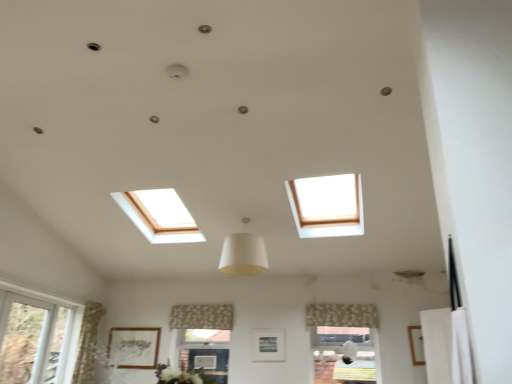
Question: Is white fabric lampshade at center oriented away from matte silver picture frame at center, the 2th picture frame when ordered from right to left?

Choices:
 (A) yes
 (B) no

Answer: (B)

Question: Does white fabric lampshade at center appear on the right side of matte silver picture frame at center, which is the 2th picture frame in front-to-back order?

Choices:
 (A) yes
 (B) no

Answer: (B)

Question: Considering the relative sizes of white fabric lampshade at center and matte silver picture frame at center, positioned as the 2th picture frame in back-to-front order, in the image provided, is white fabric lampshade at center smaller than matte silver picture frame at center, positioned as the 2th picture frame in back-to-front order,?

Choices:
 (A) no
 (B) yes

Answer: (A)

Question: Is white fabric lampshade at center shorter than matte silver picture frame at center, arranged as the second picture frame when viewed from the left?

Choices:
 (A) no
 (B) yes

Answer: (A)

Question: Could you tell me if white fabric lampshade at center is facing matte silver picture frame at center, which is the 2th picture frame in front-to-back order?

Choices:
 (A) yes
 (B) no

Answer: (B)

Question: Is the position of white fabric lampshade at center less distant than that of matte silver picture frame at center, arranged as the second picture frame when viewed from the left?

Choices:
 (A) no
 (B) yes

Answer: (B)

Question: From a real-world perspective, is patterned fabric curtain at lower center, which appears as the 1th curtain when viewed from the right, physically above matte silver picture frame at center, positioned as the 2th picture frame in back-to-front order?

Choices:
 (A) no
 (B) yes

Answer: (B)

Question: Is patterned fabric curtain at lower center, the first curtain when ordered from front to back, to the right of matte silver picture frame at center, which is the 2th picture frame in front-to-back order, from the viewer's perspective?

Choices:
 (A) no
 (B) yes

Answer: (B)

Question: Is patterned fabric curtain at lower center, which appears as the 1th curtain when viewed from the right, taller than matte silver picture frame at center, positioned as the 2th picture frame in back-to-front order?

Choices:
 (A) yes
 (B) no

Answer: (B)

Question: Can you confirm if patterned fabric curtain at lower center, arranged as the second curtain when viewed from the back, is smaller than matte silver picture frame at center, which is the 2th picture frame in front-to-back order?

Choices:
 (A) yes
 (B) no

Answer: (B)

Question: Would you consider patterned fabric curtain at lower center, which appears as the 1th curtain when viewed from the right, to be distant from matte silver picture frame at center, the 2th picture frame when ordered from right to left?

Choices:
 (A) no
 (B) yes

Answer: (A)

Question: Is matte silver picture frame at center, which is the 2th picture frame in front-to-back order, inside patterned fabric curtain at lower center, positioned as the 2th curtain in left-to-right order?

Choices:
 (A) yes
 (B) no

Answer: (B)

Question: Is the position of matte silver picture frame at center, positioned as the 2th picture frame in back-to-front order, less distant than that of white fabric lampshade at center?

Choices:
 (A) no
 (B) yes

Answer: (A)